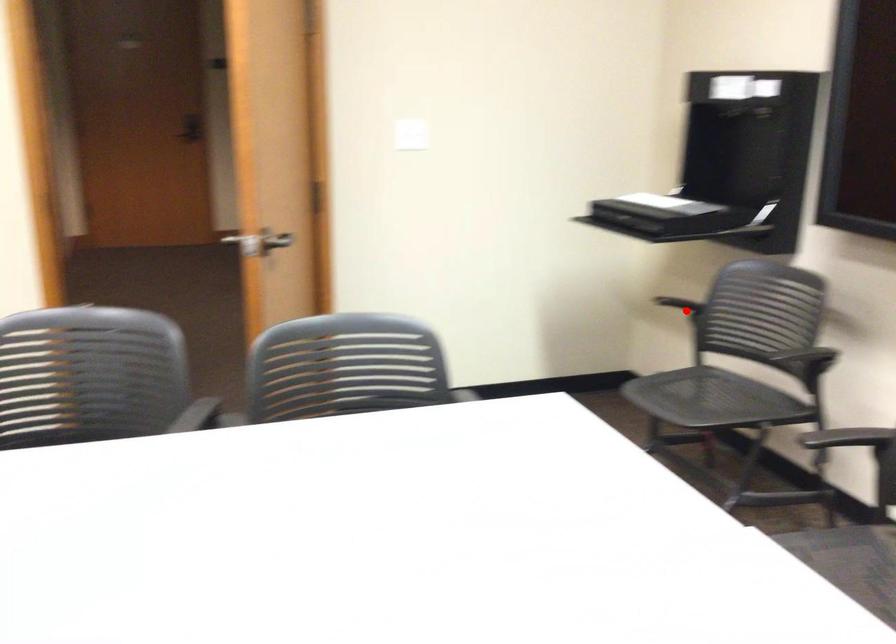
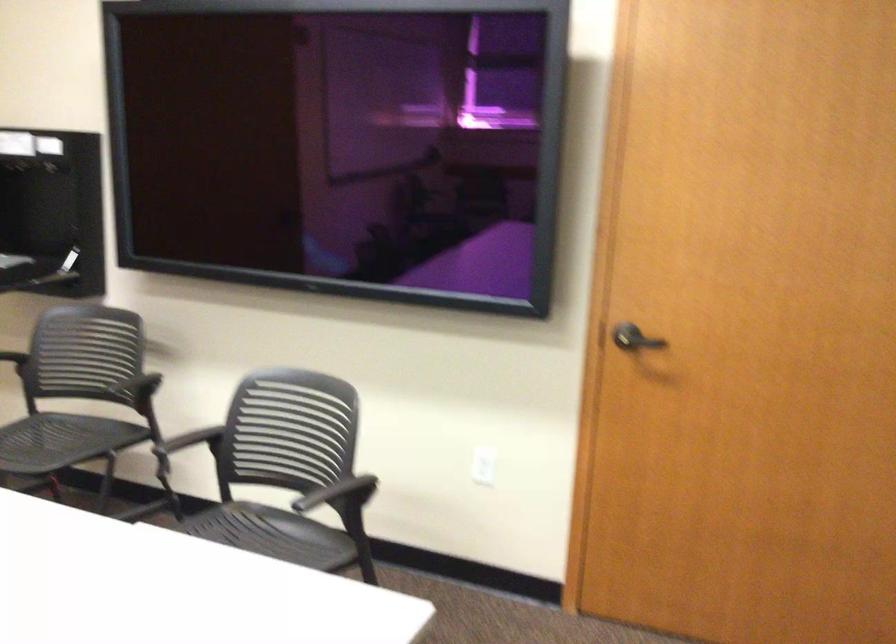
Find the pixel in the second image that matches the highlighted location in the first image.

(13, 357)